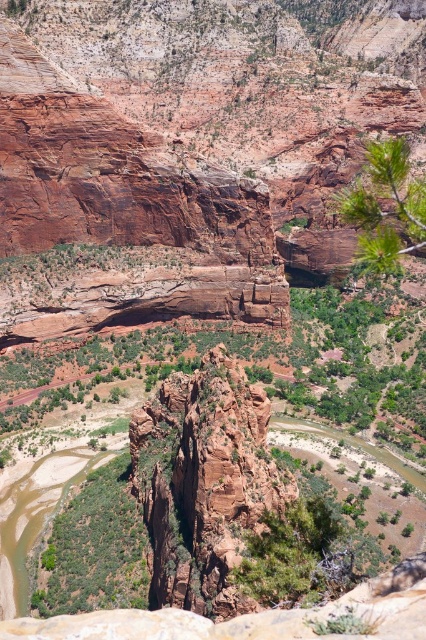
You are standing at the edge of the canyon and notice two green leafy elements in the scene. The first is the green leafy shrubs at center, and the second is the green leafy branch at upper right. Which of these two elements is positioned closer to your current viewpoint?

The green leafy shrubs at center are closer to the viewer than the green leafy branch at upper right, as stated in the description.

You are a hiker planning to take a photo of the green leafy shrubs at center and the green leafy branch at upper right. You want to ensure both are in focus. Given that your camera can focus on objects within a 200 feet range from the point where you stand, can you capture both in a single shot?

The green leafy shrubs at center is 283.51 feet from the green leafy branch at upper right. Since the distance between them exceeds the camera focus range of 200 feet, you cannot capture both in focus in a single shot.